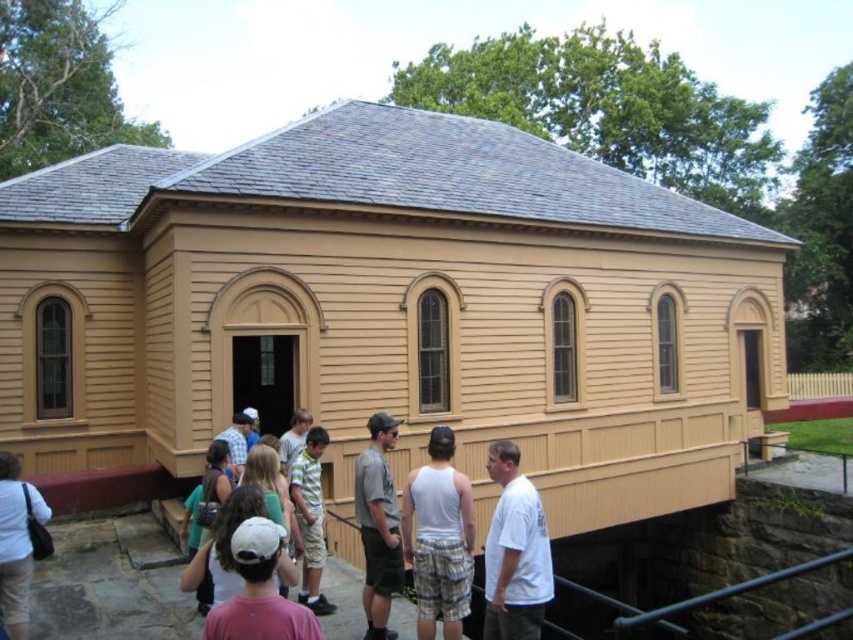
Looking at this image, you are a photographer standing in front of the historic building. You notice two white items at the center of the scene, a white tank top at center and a white cap at center. Which one is positioned lower in the image?

The white tank top at center is below the white cap at center, so the white tank top at center is positioned lower in the image.

You are a photographer trying to capture a photo of the historic building while avoiding any people in the frame. You notice a camouflage shorts at center and a white cotton cap at center. Which object should you focus on to ensure the person wearing them is not blocking your view of the building?

You should focus on the camouflage shorts at center because it is below the white cotton cap at center, meaning the cap is higher up and might block the view while the shorts are lower and less likely to obstruct the building.

Consider the image. You are standing at the entrance of the historic building and want to greet both the person wearing the pink cotton shirt at lower center and the person wearing the white cotton shirt at lower left. Which direction should you walk to reach each of them first?

The pink cotton shirt at lower center is closer to the entrance than the white cotton shirt at lower left, so you should walk towards the pink cotton shirt at lower center first.